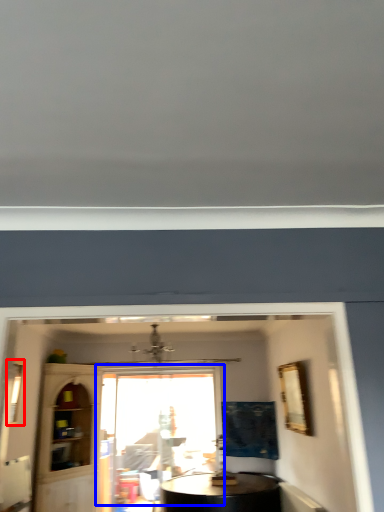
Question: Which object appears farthest to the camera in this image, window (highlighted by a red box) or window (highlighted by a blue box)?

Choices:
 (A) window
 (B) window

Answer: (B)